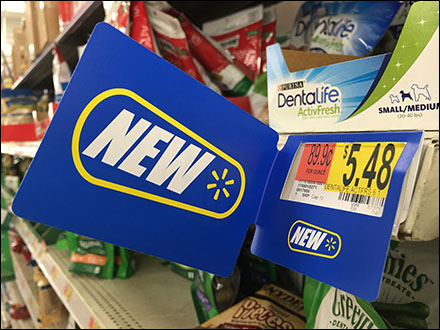
Where is `leaning red bags top shelf`? The image size is (440, 330). leaning red bags top shelf is located at coordinates (x=220, y=49), (x=178, y=41), (x=141, y=33), (x=117, y=17).